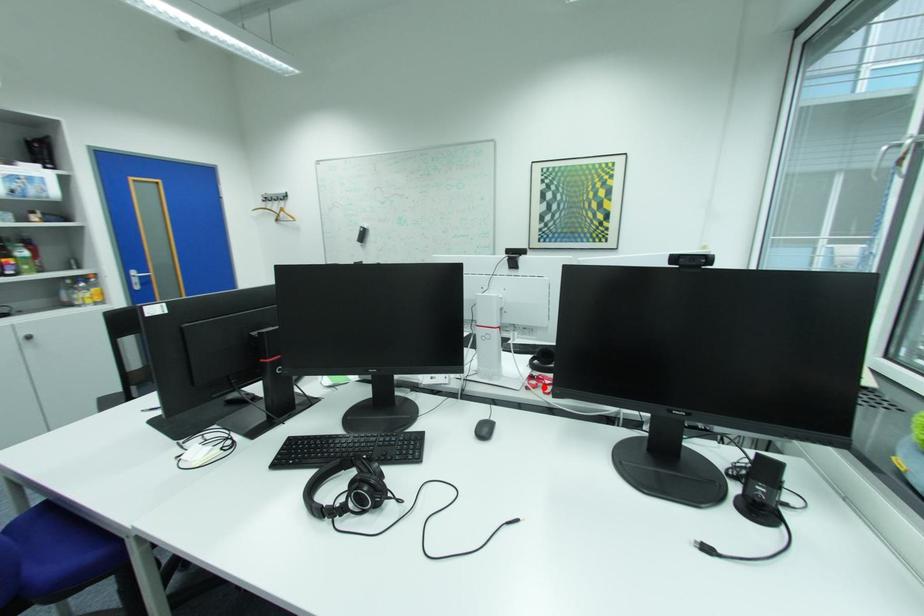
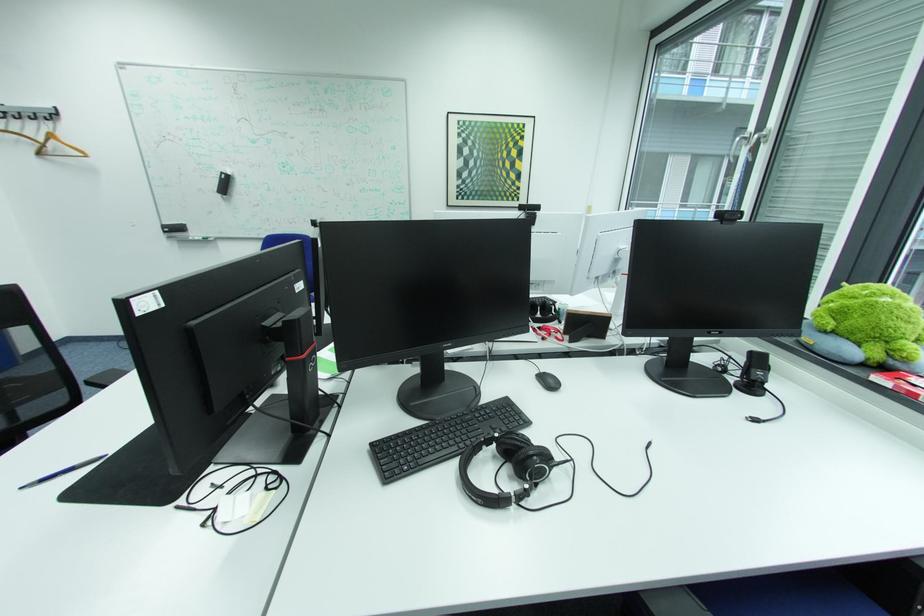
Where in the second image is the point corresponding to the highlighted location from the first image?

(558, 337)